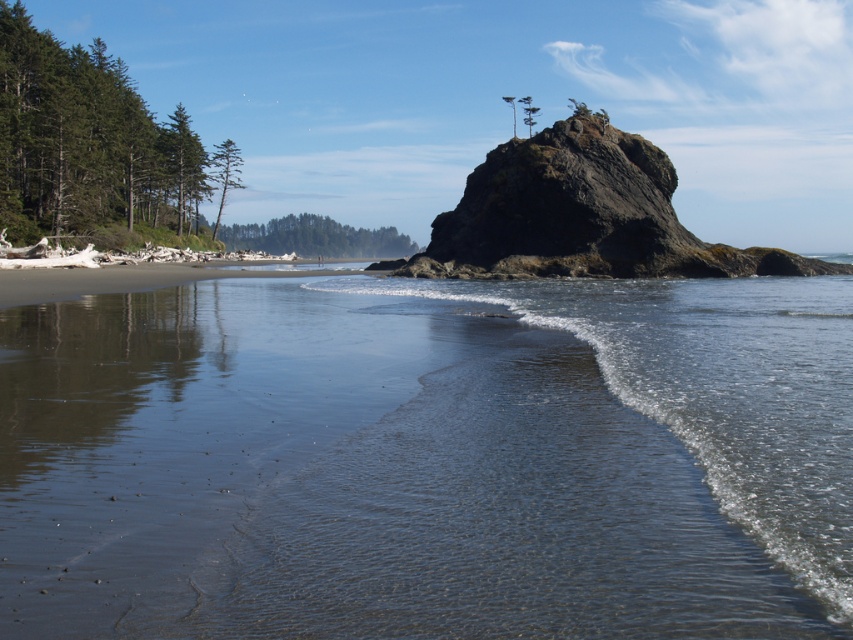
Describe the element at coordinates (428, 460) in the screenshot. The image size is (853, 640). I see `clear water at center` at that location.

Who is shorter, clear water at center or sandy beach at lower left?

clear water at center is shorter.

Who is more forward, (x=461, y=378) or (x=318, y=273)?

Point (x=461, y=378) is in front.

Where is `clear water at center`? The height and width of the screenshot is (640, 853). clear water at center is located at coordinates (428, 460).

What do you see at coordinates (428, 460) in the screenshot? I see `clear water at center` at bounding box center [428, 460].

Does clear water at center have a greater height compared to rough textured rock at center?

No, clear water at center is not taller than rough textured rock at center.

Between point (108, 481) and point (657, 237), which one is positioned in front?

Point (108, 481) is more forward.

At what (x,y) coordinates should I click in order to perform the action: click on clear water at center. Please return your answer as a coordinate pair (x, y). The image size is (853, 640). Looking at the image, I should click on (428, 460).

Is point (529, 186) in front of point (38, 273)?

No.

Is rough textured rock at center above sandy beach at lower left?

Correct, rough textured rock at center is located above sandy beach at lower left.

Between point (461, 196) and point (32, 268), which one is positioned behind?

The point (461, 196) is behind.

The height and width of the screenshot is (640, 853). Identify the location of rough textured rock at center. (579, 216).